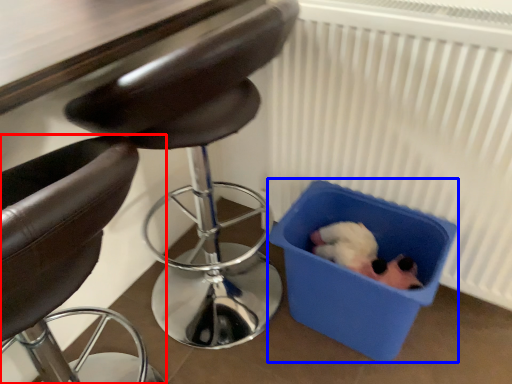
Question: Among these objects, which one is nearest to the camera, chair (highlighted by a red box) or storage box (highlighted by a blue box)?

Choices:
 (A) chair
 (B) storage box

Answer: (A)